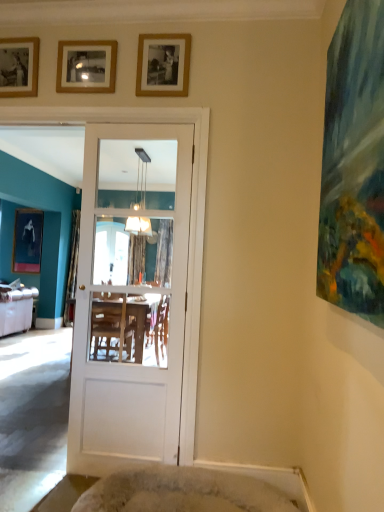
I want to click on empty space that is ontop of white glossy door at center (from a real-world perspective), so click(x=136, y=123).